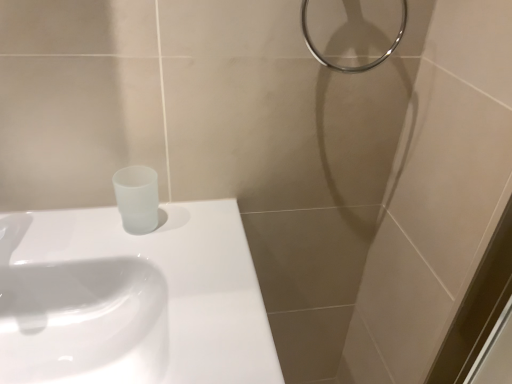
Question: Considering the relative positions of white glossy sink at lower left, positioned as the 2th sink in bottom-to-top order, and metallic ring at upper right in the image provided, is white glossy sink at lower left, positioned as the 2th sink in bottom-to-top order, in front of metallic ring at upper right?

Choices:
 (A) no
 (B) yes

Answer: (B)

Question: From the image's perspective, is white glossy sink at lower left, positioned as the 2th sink in bottom-to-top order, beneath metallic ring at upper right?

Choices:
 (A) yes
 (B) no

Answer: (A)

Question: Does white glossy sink at lower left, marked as the first sink in a top-to-bottom arrangement, appear on the left side of metallic ring at upper right?

Choices:
 (A) yes
 (B) no

Answer: (A)

Question: From a real-world perspective, is white glossy sink at lower left, marked as the first sink in a top-to-bottom arrangement, beneath metallic ring at upper right?

Choices:
 (A) yes
 (B) no

Answer: (A)

Question: Does white glossy sink at lower left, positioned as the 2th sink in bottom-to-top order, have a greater height compared to metallic ring at upper right?

Choices:
 (A) no
 (B) yes

Answer: (A)

Question: Considering the relative positions of white glossy sink at lower left, marked as the first sink in a top-to-bottom arrangement, and metallic ring at upper right in the image provided, is white glossy sink at lower left, marked as the first sink in a top-to-bottom arrangement, to the left or to the right of metallic ring at upper right?

Choices:
 (A) left
 (B) right

Answer: (A)

Question: From a real-world perspective, is white glossy sink at lower left, marked as the first sink in a top-to-bottom arrangement, physically located above or below metallic ring at upper right?

Choices:
 (A) above
 (B) below

Answer: (B)

Question: Is white glossy sink at lower left, marked as the first sink in a top-to-bottom arrangement, inside the boundaries of metallic ring at upper right, or outside?

Choices:
 (A) outside
 (B) inside

Answer: (A)

Question: Relative to metallic ring at upper right, is white glossy sink at lower left, marked as the first sink in a top-to-bottom arrangement, in front or behind?

Choices:
 (A) front
 (B) behind

Answer: (A)

Question: Considering their positions, is metallic ring at upper right located in front of or behind white glossy sink at upper left, the 1th sink when ordered from bottom to top?

Choices:
 (A) front
 (B) behind

Answer: (B)

Question: Would you say metallic ring at upper right is to the left or to the right of white glossy sink at upper left, the 1th sink when ordered from bottom to top, in the picture?

Choices:
 (A) right
 (B) left

Answer: (A)

Question: Is point (302, 31) positioned closer to the camera than point (44, 284)?

Choices:
 (A) farther
 (B) closer

Answer: (B)

Question: From a real-world perspective, is metallic ring at upper right above or below white glossy sink at upper left, the 1th sink when ordered from bottom to top?

Choices:
 (A) above
 (B) below

Answer: (A)

Question: Do you think white glossy sink at upper left, the 1th sink when ordered from bottom to top, is within white glossy sink at lower left, marked as the first sink in a top-to-bottom arrangement, or outside of it?

Choices:
 (A) inside
 (B) outside

Answer: (B)

Question: From their relative heights in the image, would you say white glossy sink at upper left, the 1th sink when ordered from bottom to top, is taller or shorter than white glossy sink at lower left, marked as the first sink in a top-to-bottom arrangement?

Choices:
 (A) short
 (B) tall

Answer: (B)